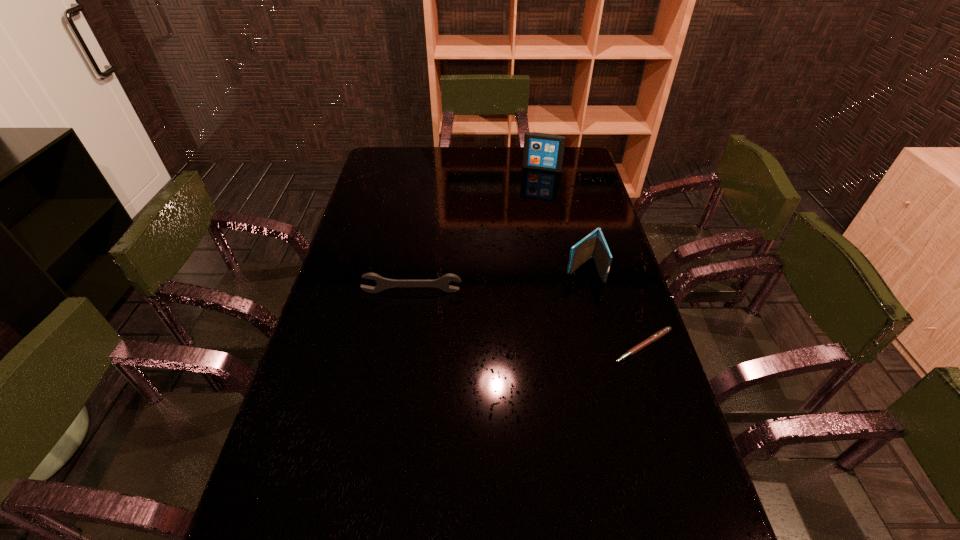
This screenshot has height=540, width=960. I want to click on vacant space that is in between the nearest object and the third farthest object, so click(x=528, y=319).

Where is `vacant area between the second farthest object and the pen`? The image size is (960, 540). vacant area between the second farthest object and the pen is located at coordinates (613, 307).

Find the location of a particular element. This screenshot has width=960, height=540. free space between the farthest object and the wrench is located at coordinates (477, 230).

Find the location of a particular element. The height and width of the screenshot is (540, 960). empty space that is in between the second farthest object and the wrench is located at coordinates (497, 281).

In order to click on free space between the third tallest object and the shortest object in this screenshot , I will do `click(528, 319)`.

Locate which object is the second closest to the third shortest object. Please provide its 2D coordinates. Your answer should be formatted as a tuple, i.e. [(x, y)], where the tuple contains the x and y coordinates of a point satisfying the conditions above.

[(383, 283)]

Identify which object is located as the nearest to the wallet. Please provide its 2D coordinates. Your answer should be formatted as a tuple, i.e. [(x, y)], where the tuple contains the x and y coordinates of a point satisfying the conditions above.

[(664, 331)]

Locate an element on the screen. vacant area in the image that satisfies the following two spatial constraints: 1. on the front side of the second tallest object; 2. on the right side of the iPod is located at coordinates (561, 269).